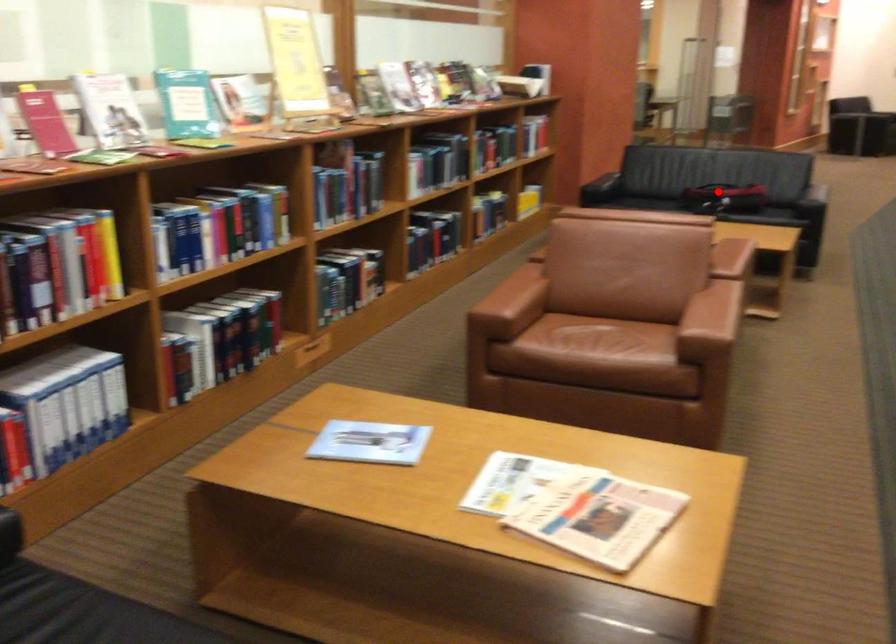
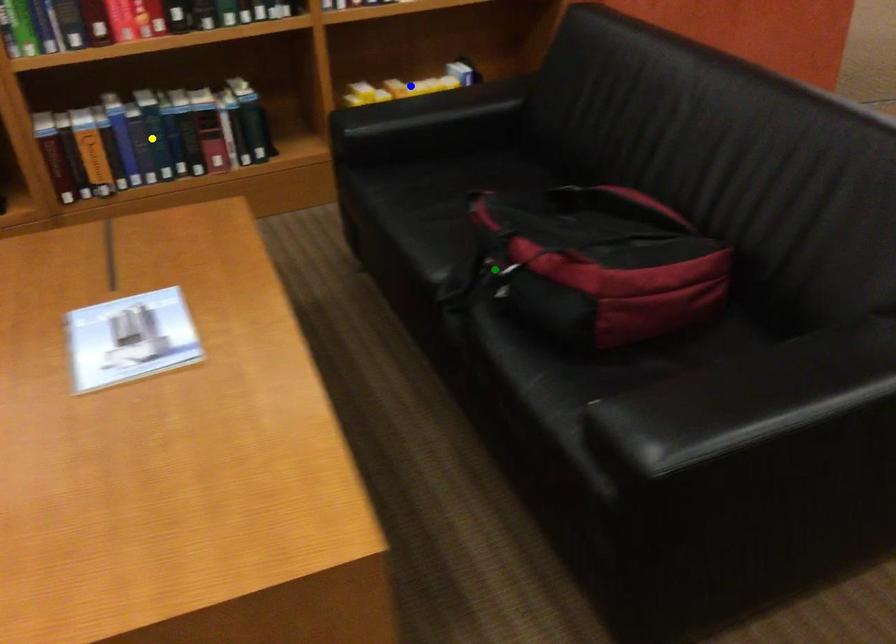
Question: I am providing you with two images of the same scene from different viewpoints. A red point is marked on the first image. You are given multiple points on the second image. Which spot in image 2 lines up with the point in image 1?

Choices:
 (A) blue point
 (B) yellow point
 (C) green point

Answer: (C)